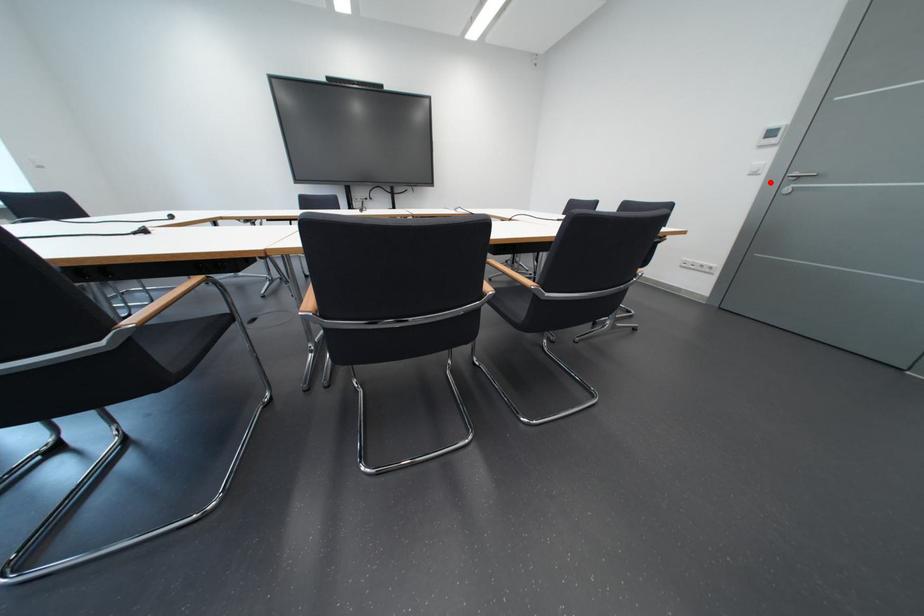
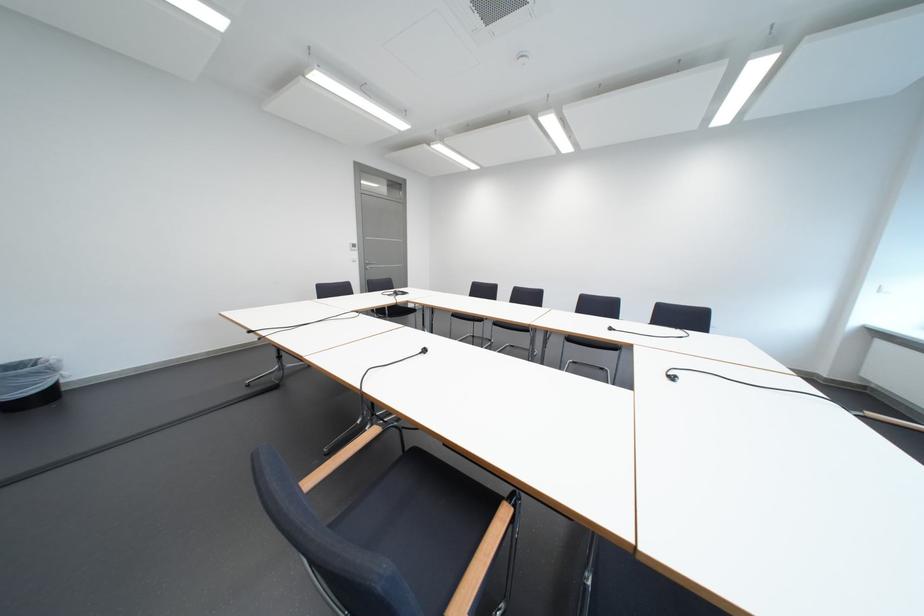
Where in the second image is the point corresponding to the highlighted location from the first image?

(369, 265)